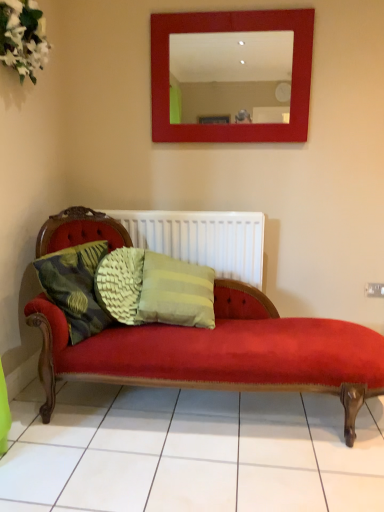
Question: Is white fabric flowers at upper left at the left side of white textured radiator at center?

Choices:
 (A) yes
 (B) no

Answer: (A)

Question: From a real-world perspective, is white fabric flowers at upper left below white textured radiator at center?

Choices:
 (A) no
 (B) yes

Answer: (A)

Question: From the image's perspective, does white fabric flowers at upper left appear higher than white textured radiator at center?

Choices:
 (A) no
 (B) yes

Answer: (B)

Question: Can we say white fabric flowers at upper left lies outside white textured radiator at center?

Choices:
 (A) yes
 (B) no

Answer: (A)

Question: Is white fabric flowers at upper left not close to white textured radiator at center?

Choices:
 (A) no
 (B) yes

Answer: (B)

Question: Based on their positions, is white fabric flowers at upper left located to the left or right of green textured cushion at left?

Choices:
 (A) right
 (B) left

Answer: (B)

Question: Considering the positions of point (14, 52) and point (82, 310), is point (14, 52) closer or farther from the camera than point (82, 310)?

Choices:
 (A) closer
 (B) farther

Answer: (A)

Question: From a real-world perspective, is white fabric flowers at upper left positioned above or below green textured cushion at left?

Choices:
 (A) below
 (B) above

Answer: (B)

Question: From the image's perspective, is white fabric flowers at upper left above or below green textured cushion at left?

Choices:
 (A) above
 (B) below

Answer: (A)

Question: Based on their positions, is white textured radiator at center located to the left or right of green textured cushion at left?

Choices:
 (A) left
 (B) right

Answer: (B)

Question: From the image's perspective, is white textured radiator at center positioned above or below green textured cushion at left?

Choices:
 (A) above
 (B) below

Answer: (A)

Question: From a real-world perspective, is white textured radiator at center physically located above or below green textured cushion at left?

Choices:
 (A) below
 (B) above

Answer: (B)

Question: Does point (228, 266) appear closer or farther from the camera than point (77, 303)?

Choices:
 (A) farther
 (B) closer

Answer: (A)

Question: Looking at the image, does white textured radiator at center seem bigger or smaller compared to white fabric flowers at upper left?

Choices:
 (A) small
 (B) big

Answer: (B)

Question: Looking at their shapes, would you say white textured radiator at center is wider or thinner than white fabric flowers at upper left?

Choices:
 (A) wide
 (B) thin

Answer: (B)